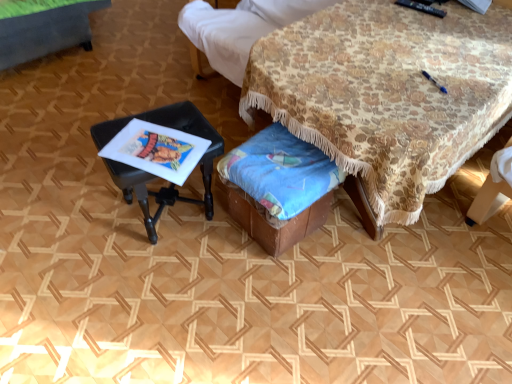
Identify the location of free space in front of black plastic stool at left, placed as the 2th table when sorted from right to left. (156, 279).